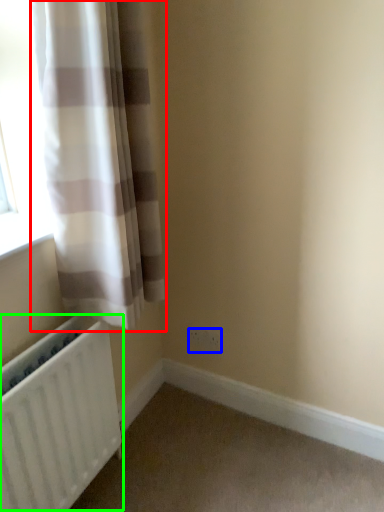
Question: Estimate the real-world distances between objects in this image. Which object is farther from curtain (highlighted by a red box), electric outlet (highlighted by a blue box) or radiator (highlighted by a green box)?

Choices:
 (A) electric outlet
 (B) radiator

Answer: (A)